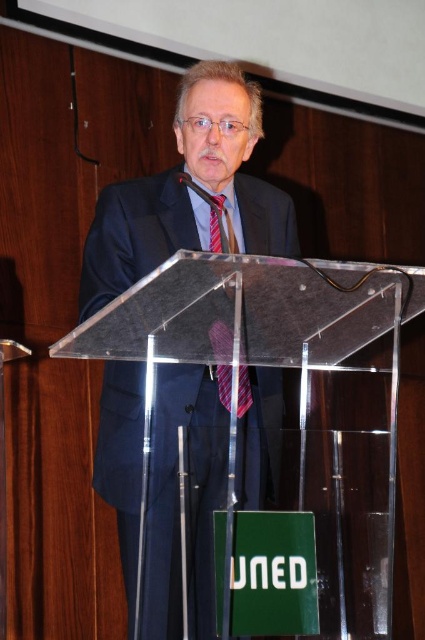
You are standing in front of the podium and see the point at coordinates (189, 493). Which object is this point located on?

The point at coordinates (189, 493) is located on the dark blue suit at center.

You are an observer at the back of the room. You notice the man in the dark blue suit at center and the red striped tie at center. Which one is closer to you?

The dark blue suit at center is closer to you because it is in front of the red striped tie at center.

A person wearing a dark blue suit at center is standing behind a transparent podium. The podium has a green sign on its front. How far apart are the person and the green sign?

The dark blue suit at center and the green sign are 1.61 meters apart.